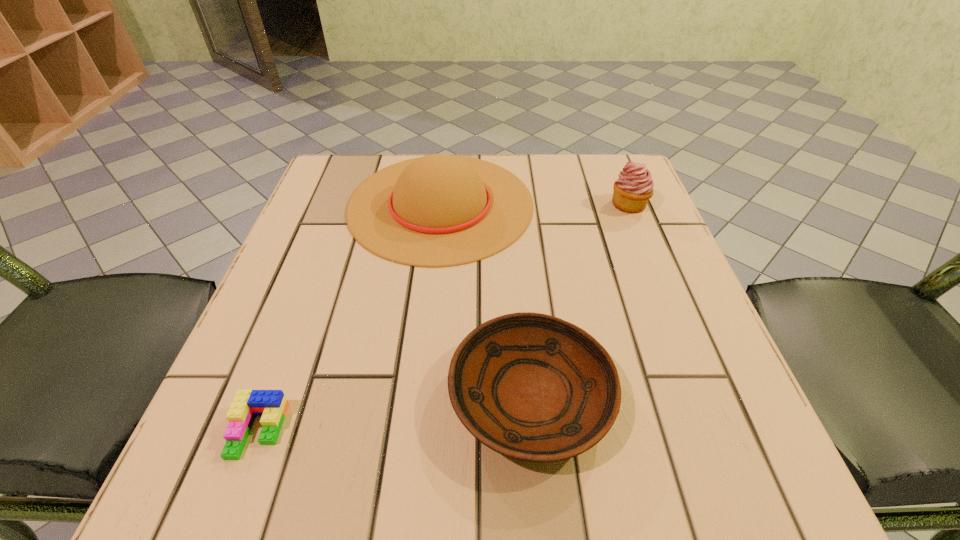
At what (x,y) coordinates should I click in order to perform the action: click on free space between the sombrero and the rightmost object. Please return your answer as a coordinate pair (x, y). The width and height of the screenshot is (960, 540). Looking at the image, I should click on (535, 204).

Locate an element on the screen. Image resolution: width=960 pixels, height=540 pixels. unoccupied position between the shortest object and the third tallest object is located at coordinates (395, 413).

The image size is (960, 540). Find the location of `empty space that is in between the sombrero and the shortest object`. empty space that is in between the sombrero and the shortest object is located at coordinates (349, 317).

I want to click on free spot between the plate and the Lego, so click(x=395, y=413).

Where is `object that is the closest one to the shortest object`? The height and width of the screenshot is (540, 960). object that is the closest one to the shortest object is located at coordinates (532, 387).

This screenshot has width=960, height=540. What are the coordinates of `object that can be found as the second closest to the shortest object` in the screenshot? It's located at (440, 210).

Find the location of `free spot that satisfies the following two spatial constraints: 1. on the front side of the sombrero; 2. on the right side of the second shortest object`. free spot that satisfies the following two spatial constraints: 1. on the front side of the sombrero; 2. on the right side of the second shortest object is located at coordinates (420, 396).

Locate an element on the screen. This screenshot has width=960, height=540. vacant space that satisfies the following two spatial constraints: 1. on the front side of the sombrero; 2. on the left side of the cupcake is located at coordinates (441, 205).